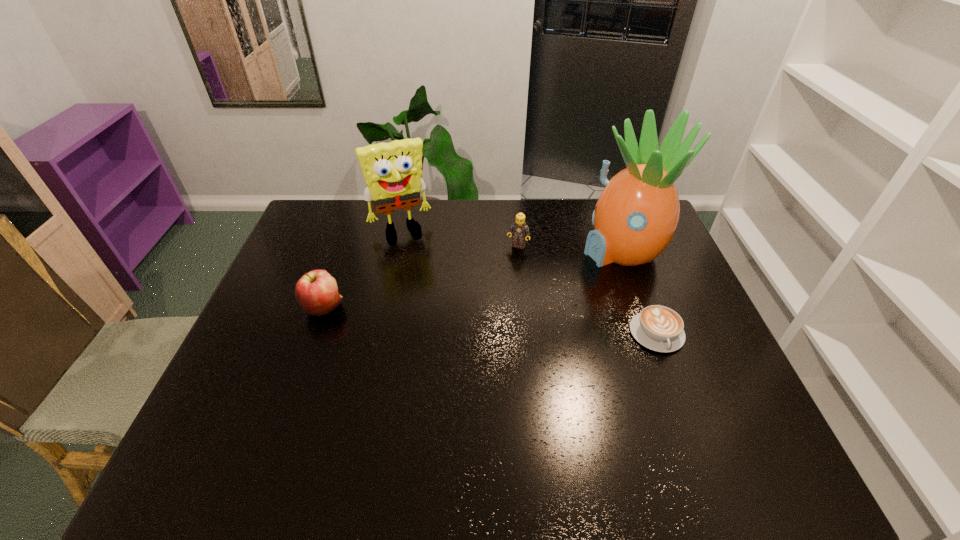
Find the location of a particular element. The image size is (960, 540). apple is located at coordinates (316, 292).

At what (x,y) coordinates should I click in order to perform the action: click on the shortest object. Please return your answer as a coordinate pair (x, y). Image resolution: width=960 pixels, height=540 pixels. Looking at the image, I should click on (659, 328).

The width and height of the screenshot is (960, 540). Identify the location of Lego. (519, 228).

I want to click on the second tallest object, so click(x=392, y=171).

Where is `sponge`? This screenshot has width=960, height=540. sponge is located at coordinates (392, 171).

This screenshot has width=960, height=540. I want to click on pineapple, so click(x=636, y=215).

The width and height of the screenshot is (960, 540). Find the location of `blank space located 0.340m on the bitten side of the apple`. blank space located 0.340m on the bitten side of the apple is located at coordinates (464, 307).

The height and width of the screenshot is (540, 960). I want to click on vacant region located on the side of the shortest object with the handle, so click(x=691, y=425).

Identify the location of blank space located in front of the Lego. The image size is (960, 540). (493, 302).

At what (x,y) coordinates should I click in order to perform the action: click on blank space located in front of the Lego. Please return your answer as a coordinate pair (x, y). The width and height of the screenshot is (960, 540). Looking at the image, I should click on (495, 297).